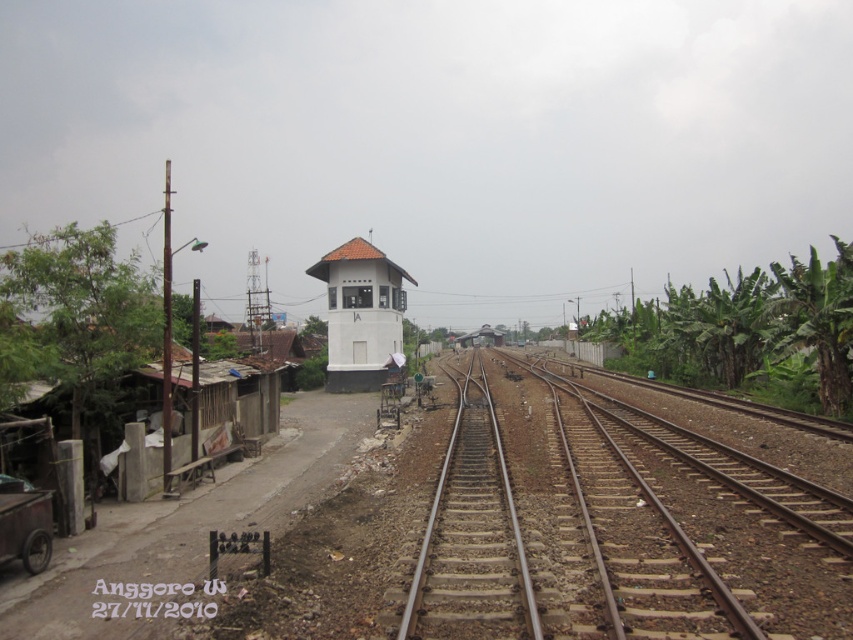
You are a maintenance worker assigned to inspect the brown metal train track at center. Your starting position is at point [619,528]. Can you directly access the brown metal train track at center from your current position?

The brown metal train track at center is located at point [619,528], so yes, you can directly access it from your current position as you are already there.

You are a passenger on the metallic silver train at center and want to see the white matte water tower at center from your seat. Is the water tower visible from your current position?

The white matte water tower at center is in front of the metallic silver train at center, so yes, it is visible from the train seat as it is positioned ahead of the train.

You are a railway worker inspecting the tracks. You notice the brown metal train track at center and the metallic silver train at center. Which object is smaller in size?

The brown metal train track at center is smaller in size compared to the metallic silver train at center according to the description.